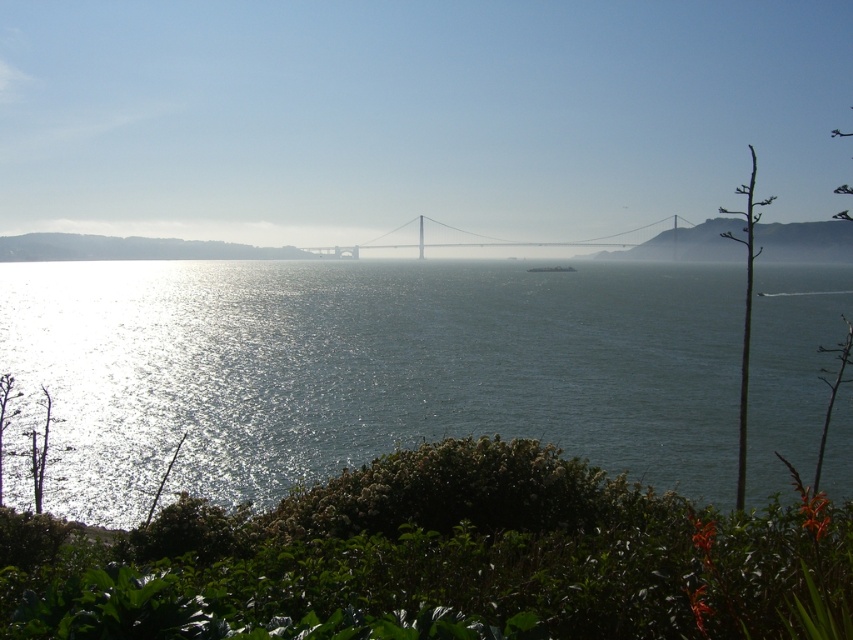
Who is lower down, glistening water at center or green leafy bush at lower center?

green leafy bush at lower center is lower down.

Does glistening water at center have a greater width compared to green leafy bush at lower center?

Yes, glistening water at center is wider than green leafy bush at lower center.

You are a GUI agent. You are given a task and a screenshot of the screen. Output one action in this format:
    pyautogui.click(x=<x>, y=<y>)
    Task: Click on the glistening water at center
    This screenshot has width=853, height=640.
    Given the screenshot: What is the action you would take?
    pyautogui.click(x=364, y=371)

Can you confirm if green leafy bush at lower center is positioned below metallic golden bridge at center?

Correct, green leafy bush at lower center is located below metallic golden bridge at center.

Who is more forward, (790, 616) or (474, 244)?

Point (790, 616)

Which is in front, point (25, 596) or point (611, 243)?

Point (25, 596) is more forward.

At what (x,y) coordinates should I click in order to perform the action: click on green leafy bush at lower center. Please return your answer as a coordinate pair (x, y). The height and width of the screenshot is (640, 853). Looking at the image, I should click on (440, 560).

Measure the distance between glistening water at center and camera.

glistening water at center and camera are 18.65 meters apart from each other.

Is glistening water at center in front of metallic golden bridge at center?

Yes.

You are a GUI agent. You are given a task and a screenshot of the screen. Output one action in this format:
    pyautogui.click(x=<x>, y=<y>)
    Task: Click on the glistening water at center
    Image resolution: width=853 pixels, height=640 pixels.
    Given the screenshot: What is the action you would take?
    pyautogui.click(x=364, y=371)

This screenshot has height=640, width=853. Find the location of `glistening water at center`. glistening water at center is located at coordinates (364, 371).